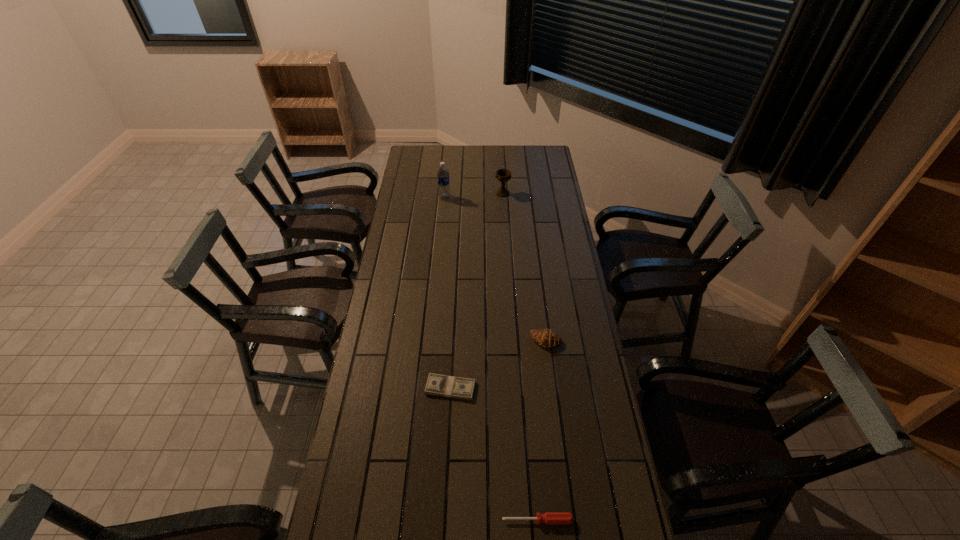
Find the location of a particular element. This screenshot has width=960, height=540. water bottle is located at coordinates (442, 174).

At what (x,y) coordinates should I click in order to perform the action: click on the second tallest object. Please return your answer as a coordinate pair (x, y). This screenshot has height=540, width=960. Looking at the image, I should click on (503, 175).

Identify the location of crescent roll. The height and width of the screenshot is (540, 960). (546, 338).

Find the location of a particular element. The width and height of the screenshot is (960, 540). the third shortest object is located at coordinates (546, 338).

Where is `screwdriver`? This screenshot has height=540, width=960. screwdriver is located at coordinates (549, 518).

In order to click on the second shortest object in this screenshot , I will do (x=549, y=518).

What are the coordinates of `the fourth farthest object` in the screenshot? It's located at (441, 385).

Locate an element on the screen. the shortest object is located at coordinates (441, 385).

Locate an element on the screen. The width and height of the screenshot is (960, 540). free space located 0.320m on the right of the tallest object is located at coordinates (513, 197).

The height and width of the screenshot is (540, 960). I want to click on free space located on the right of the chalice, so click(x=536, y=193).